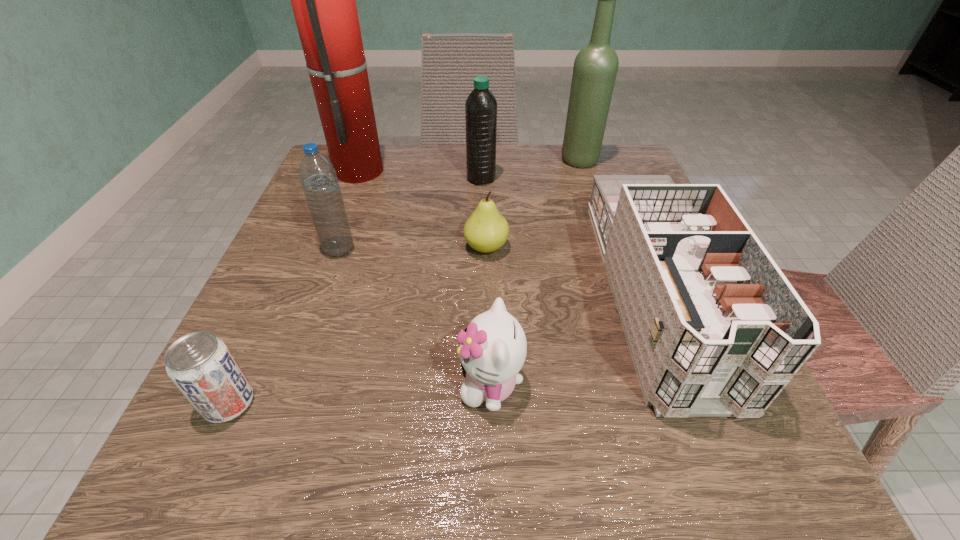
Locate an element on the screen. object positioned at the near left corner is located at coordinates (202, 367).

You are a GUI agent. You are given a task and a screenshot of the screen. Output one action in this format:
    pyautogui.click(x=<x>, y=<y>)
    Task: Click on the object that is at the far right corner
    The width and height of the screenshot is (960, 540).
    Given the screenshot: What is the action you would take?
    pyautogui.click(x=595, y=68)

Identify the location of object that is at the near right corner. (715, 329).

In the image, there is a desktop. What are the coordinates of `vacant space at the far edge` in the screenshot? It's located at (406, 163).

This screenshot has width=960, height=540. Find the location of `vacant space at the near edge`. vacant space at the near edge is located at coordinates (309, 487).

Locate an element on the screen. vacant space at the left edge of the desktop is located at coordinates (262, 331).

Where is `blank space at the right edge`? The height and width of the screenshot is (540, 960). blank space at the right edge is located at coordinates (669, 418).

Where is `free space at the far right corner of the desktop`? free space at the far right corner of the desktop is located at coordinates (601, 163).

Locate an element on the screen. The height and width of the screenshot is (540, 960). unoccupied position between the right water bottle and the nearer water bottle is located at coordinates tap(410, 214).

Image resolution: width=960 pixels, height=540 pixels. In order to click on blank region between the soda can and the wine bottle in this screenshot , I will do `click(404, 281)`.